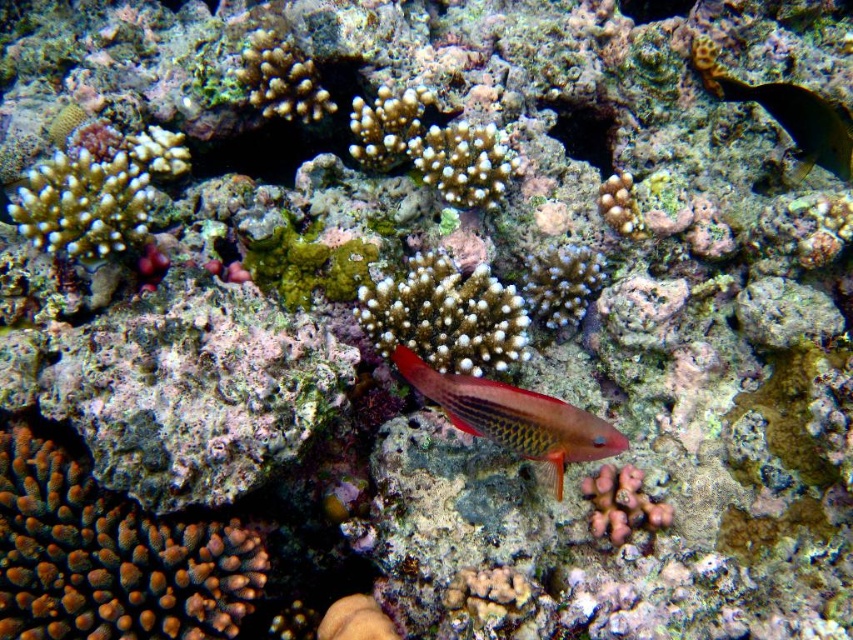
From the picture: You are a marine biologist observing the underwater scene. You notice the white coral at center and the shiny red fish at center. Based on their positions, which object is located to the right side of the other?

The white coral at center is to the left of the shiny red fish at center, so the shiny red fish at center is located to the right side of the white coral at center.

You are a marine biologist observing the underwater scene. You notice the white coral at center and the shiny yellow fish at upper right. Which object is shorter in height?

The white coral at center has a lesser height compared to the shiny yellow fish at upper right, so the white coral at center is shorter in height.